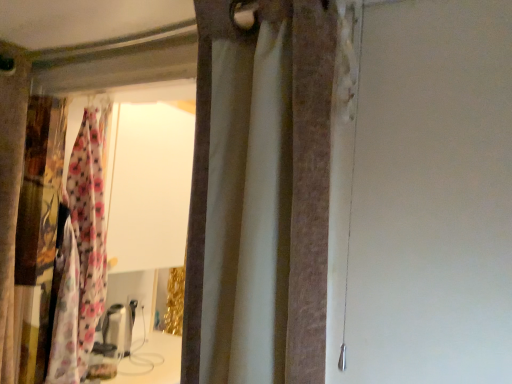
This screenshot has height=384, width=512. In order to click on satin beige curtain at center in this screenshot , I will do `click(264, 189)`.

Describe the element at coordinates (264, 189) in the screenshot. I see `satin beige curtain at center` at that location.

Identify the location of satin beige curtain at center. This screenshot has width=512, height=384. (x=264, y=189).